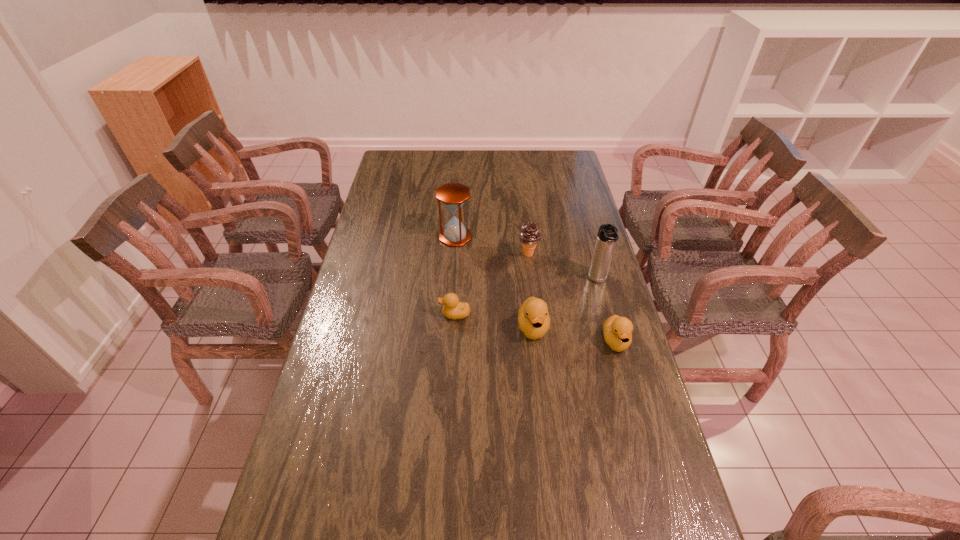
Find the location of `free space at the left edge of the desktop`. free space at the left edge of the desktop is located at coordinates (334, 468).

You are a GUI agent. You are given a task and a screenshot of the screen. Output one action in this format:
    pyautogui.click(x=<x>, y=<y>)
    Task: Click on the free space at the right edge of the desktop
    
    Given the screenshot: What is the action you would take?
    coord(583,268)

Where is `vacant area between the fifth tallest object and the hourglass`? This screenshot has width=960, height=540. vacant area between the fifth tallest object and the hourglass is located at coordinates (536, 289).

Find the location of a particular element. The image size is (960, 540). blank region between the fourth tallest object and the second tallest duckling is located at coordinates (574, 334).

Locate an element on the screen. The width and height of the screenshot is (960, 540). free spot between the hourglass and the shortest duckling is located at coordinates (455, 275).

This screenshot has width=960, height=540. Identify the location of unoccupied position between the shortest duckling and the thermos bottle. (526, 298).

Identify the location of empty space that is in between the leftmost duckling and the farthest object. tap(455, 275).

Where is `free area in between the icecream and the second duckling from right to left`? This screenshot has height=540, width=960. free area in between the icecream and the second duckling from right to left is located at coordinates (531, 291).

This screenshot has width=960, height=540. Find the location of `vacant point located between the shortest object and the fourth tallest object`. vacant point located between the shortest object and the fourth tallest object is located at coordinates (494, 321).

Find the location of a particular element. vacant region between the second farthest object and the tallest duckling is located at coordinates (531, 291).